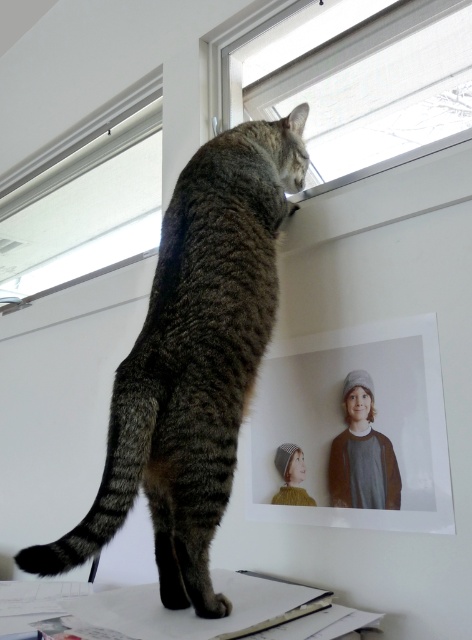
Question: Considering the real-world distances, which object is farthest from the tabby fur cat at upper center?

Choices:
 (A) transparent glass window at upper center
 (B) white matte window at upper center
 (C) matte paper photo at upper center

Answer: (B)

Question: Does matte paper photo at upper center appear under white matte window at upper center?

Choices:
 (A) yes
 (B) no

Answer: (A)

Question: Which of these objects is positioned closest to the white matte window at upper center?

Choices:
 (A) matte paper photo at upper center
 (B) transparent glass window at upper center
 (C) tabby fur cat at upper center

Answer: (B)

Question: Is matte paper photo at upper center to the left of transparent glass window at upper center from the viewer's perspective?

Choices:
 (A) yes
 (B) no

Answer: (A)

Question: Which object is the farthest from the tabby fur cat at upper center?

Choices:
 (A) transparent glass window at upper center
 (B) matte paper photo at upper center

Answer: (A)

Question: Can you confirm if transparent glass window at upper center is smaller than white matte window at upper center?

Choices:
 (A) yes
 (B) no

Answer: (A)